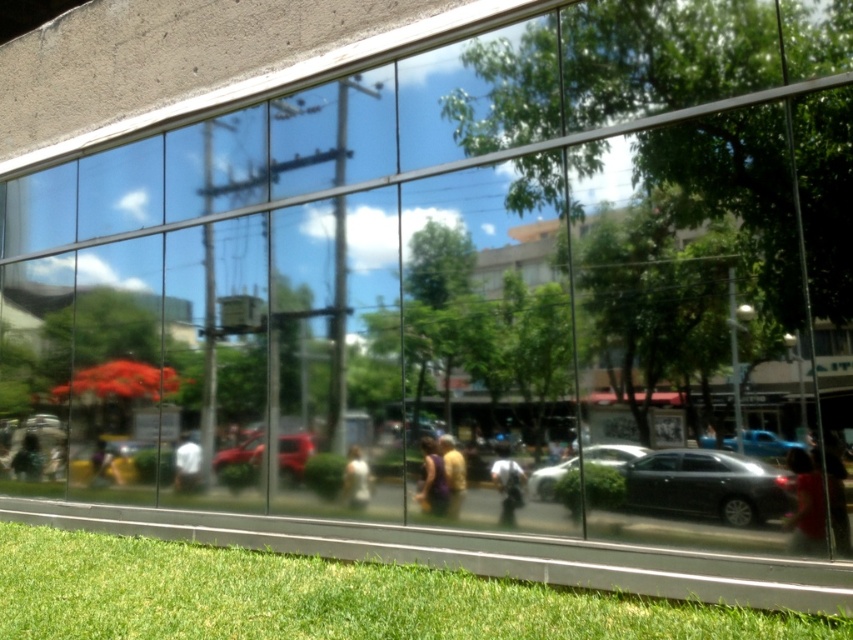
Question: Which point is farther to the camera?

Choices:
 (A) (606, 452)
 (B) (311, 451)
 (C) (497, 476)

Answer: (B)

Question: Which is nearer to the matte black person at lower right?

Choices:
 (A) blurred fabric person at lower left
 (B) matte black sedan at lower right
 (C) shiny red car at center

Answer: (B)

Question: Based on their relative distances, which object is nearer to the green grass at lower left?

Choices:
 (A) matte black person at lower right
 (B) blurred fabric person at lower left

Answer: (A)

Question: Can you confirm if green grass at lower left is wider than yellow fabric bag at center?

Choices:
 (A) no
 (B) yes

Answer: (B)

Question: Where is blue metallic car at center located in relation to white matte shirt at center in the image?

Choices:
 (A) below
 (B) above

Answer: (B)

Question: Does dark purple fabric at center come behind white matte shirt at center?

Choices:
 (A) yes
 (B) no

Answer: (B)